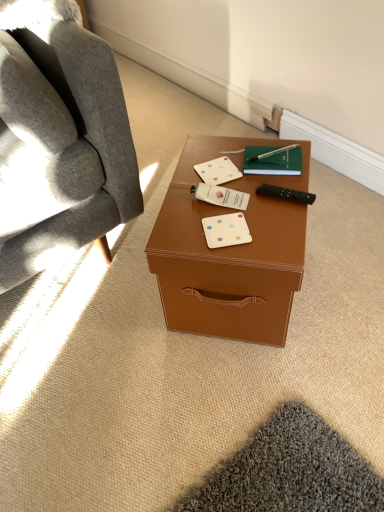
The width and height of the screenshot is (384, 512). Find the location of `free spot behind black plastic remote control at right`. free spot behind black plastic remote control at right is located at coordinates (261, 167).